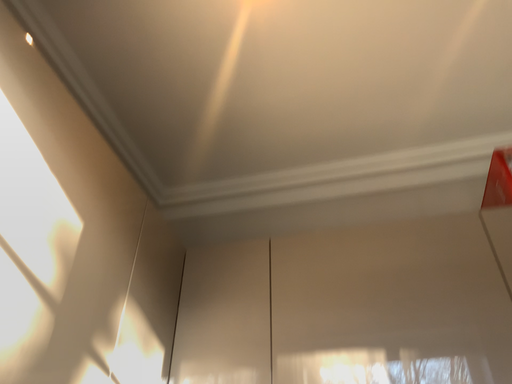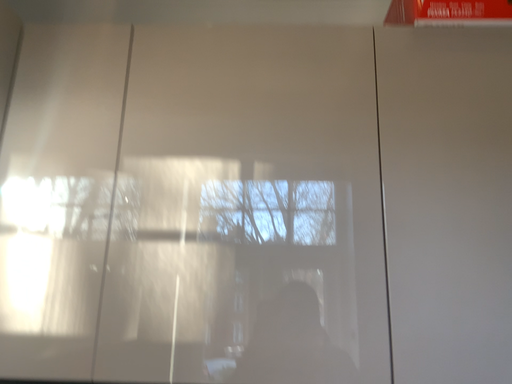
Question: Which way did the camera rotate in the video?

Choices:
 (A) rotated left
 (B) rotated right

Answer: (B)